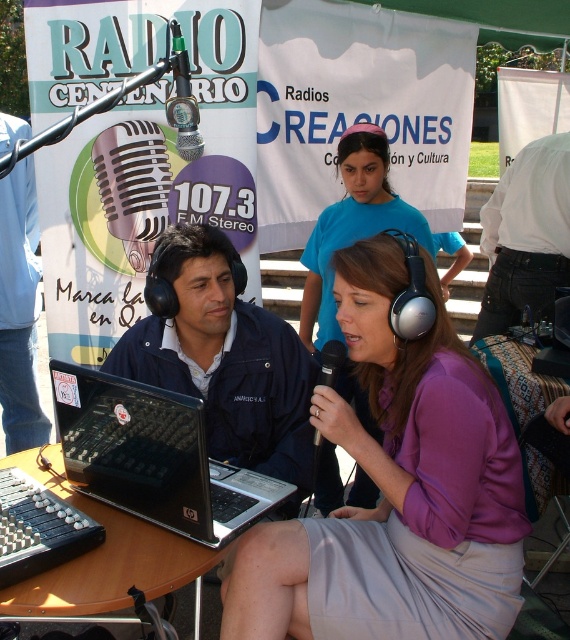
Can you confirm if purple matte shirt at center is smaller than white cotton shirt at right?

No.

Which is behind, point (306, 541) or point (494, 237)?

Point (494, 237)

Where is `purple matte shirt at center`? The width and height of the screenshot is (570, 640). purple matte shirt at center is located at coordinates (396, 492).

Between black plastic laptop at center and purple matte headphones at center, which one appears on the left side from the viewer's perspective?

From the viewer's perspective, black plastic laptop at center appears more on the left side.

Consider the image. Is black plastic laptop at center further to camera compared to purple matte headphones at center?

No, black plastic laptop at center is in front of purple matte headphones at center.

Find the location of a particular element. The image size is (570, 640). black plastic laptop at center is located at coordinates (153, 456).

Is dark blue jacket at center below white cotton shirt at right?

Indeed, dark blue jacket at center is positioned under white cotton shirt at right.

This screenshot has width=570, height=640. I want to click on dark blue jacket at center, so click(225, 358).